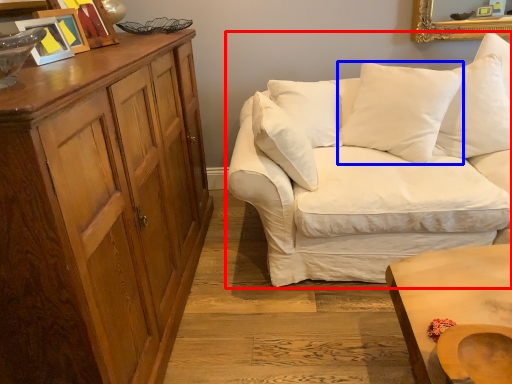
Question: Which object appears farthest to the camera in this image, studio couch (highlighted by a red box) or pillow (highlighted by a blue box)?

Choices:
 (A) studio couch
 (B) pillow

Answer: (B)